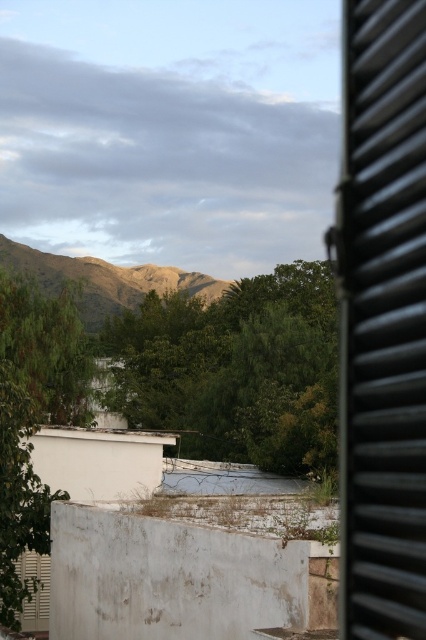
Based on the photo, can you confirm if green leafy tree at center is positioned to the left of green leafy tree at center-left?

No, green leafy tree at center is not to the left of green leafy tree at center-left.

In the scene shown: Which of these two, green leafy tree at center or green leafy tree at center-left, stands shorter?

Standing shorter between the two is green leafy tree at center-left.

Which is behind, point (290, 433) or point (23, 326)?

Positioned behind is point (290, 433).

The width and height of the screenshot is (426, 640). I want to click on green leafy tree at center, so click(236, 369).

Between black corrugated metal window at right and green leafy tree at center, which one has less height?

With less height is black corrugated metal window at right.

Based on the photo, which is more to the right, black corrugated metal window at right or green leafy tree at center?

From the viewer's perspective, black corrugated metal window at right appears more on the right side.

Find the location of a particular element. Image resolution: width=426 pixels, height=640 pixels. black corrugated metal window at right is located at coordinates (382, 320).

Locate an element on the screen. Image resolution: width=426 pixels, height=640 pixels. black corrugated metal window at right is located at coordinates (382, 320).

Can you confirm if black corrugated metal window at right is smaller than brown textured mountain at center?

Correct, black corrugated metal window at right occupies less space than brown textured mountain at center.

Which of these two, black corrugated metal window at right or brown textured mountain at center, stands shorter?

With less height is black corrugated metal window at right.

Between point (359, 68) and point (100, 273), which one is positioned behind?

Positioned behind is point (100, 273).

Where is `black corrugated metal window at right`? This screenshot has height=640, width=426. black corrugated metal window at right is located at coordinates (382, 320).